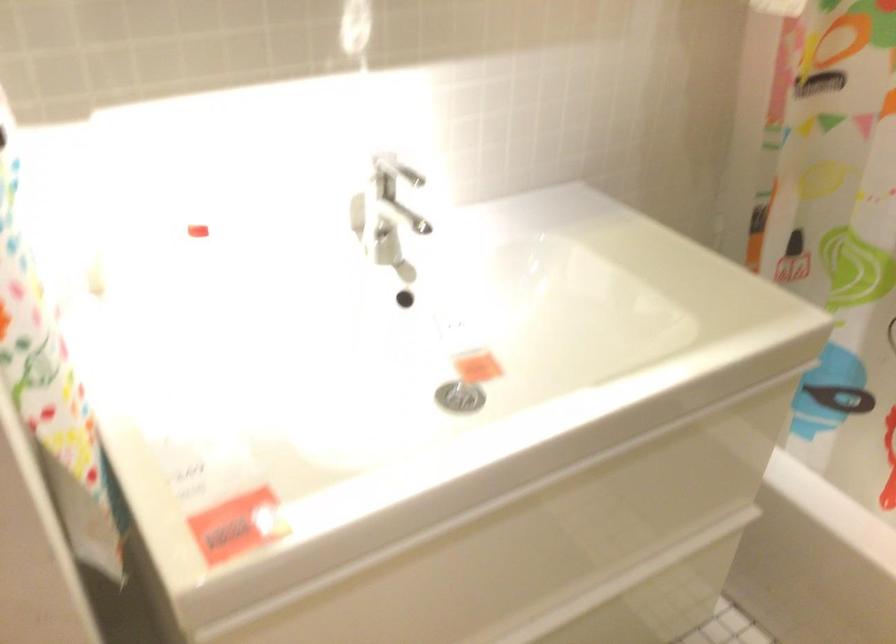
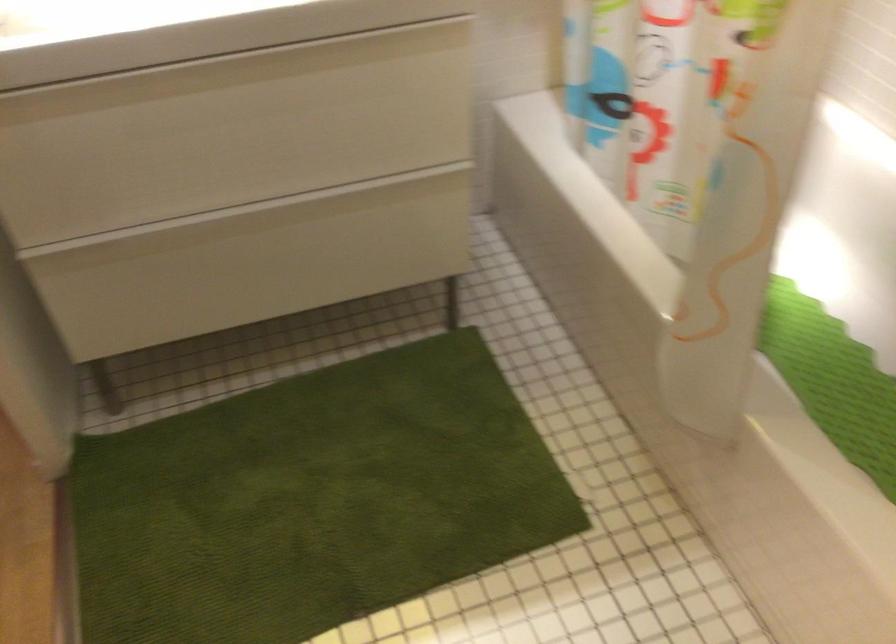
Question: The first image is from the beginning of the video and the second image is from the end. How did the camera likely rotate when shooting the video?

Choices:
 (A) Left
 (B) Right
 (C) Up
 (D) Down

Answer: (A)